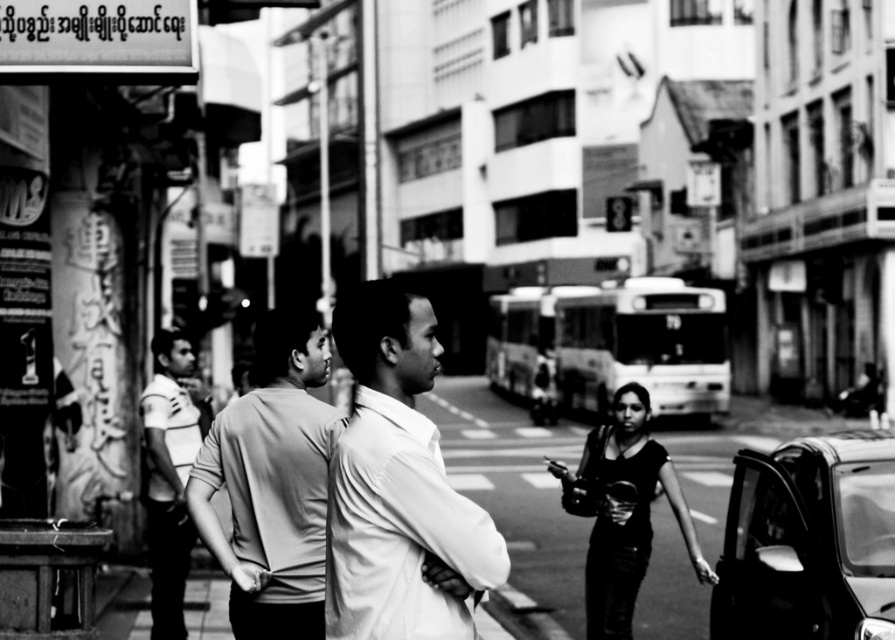
You are a photographer trying to capture the white smooth shirt at center in this black and white photo. The camera has a focus point at coordinates point (398, 486). Will the focus point align with the white smooth shirt at center?

Yes, the focus point at point (398, 486) corresponds to the white smooth shirt at center, so the focus point will align with the white smooth shirt at center.